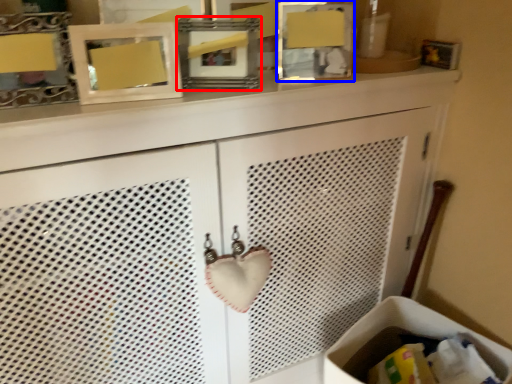
Question: Among these objects, which one is farthest to the camera, picture frame (highlighted by a red box) or picture frame (highlighted by a blue box)?

Choices:
 (A) picture frame
 (B) picture frame

Answer: (B)